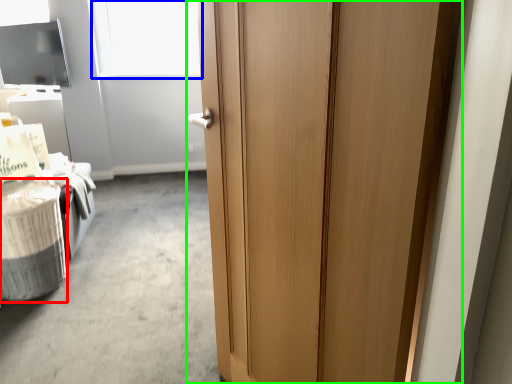
Question: Which object is the farthest from laundry basket (highlighted by a red box)? Choose among these: window screen (highlighted by a blue box) or door (highlighted by a green box).

Choices:
 (A) window screen
 (B) door

Answer: (A)